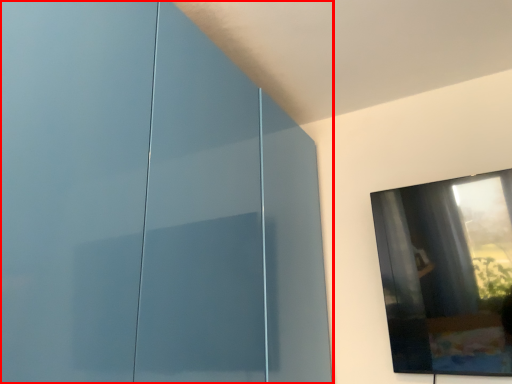
Question: In this image, where is glass door (annotated by the red box) located relative to window?

Choices:
 (A) left
 (B) right

Answer: (A)